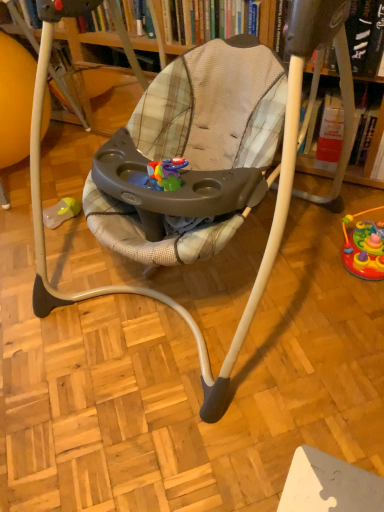
Locate an element on the screen. The height and width of the screenshot is (512, 384). vacant space behind rubberized plastic toy at lower right is located at coordinates (318, 214).